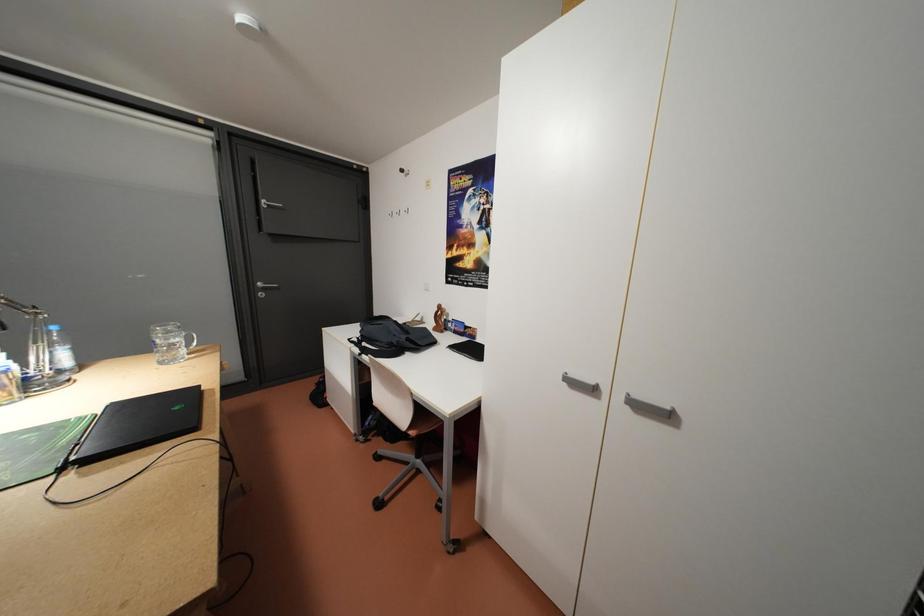
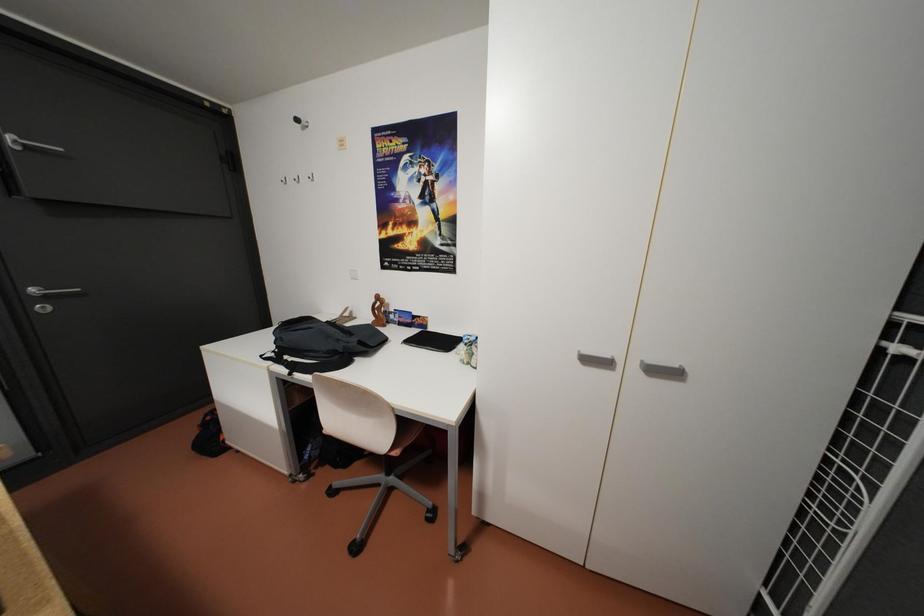
Question: How did the camera likely rotate?

Choices:
 (A) Left
 (B) Right
 (C) Up
 (D) Down

Answer: (B)